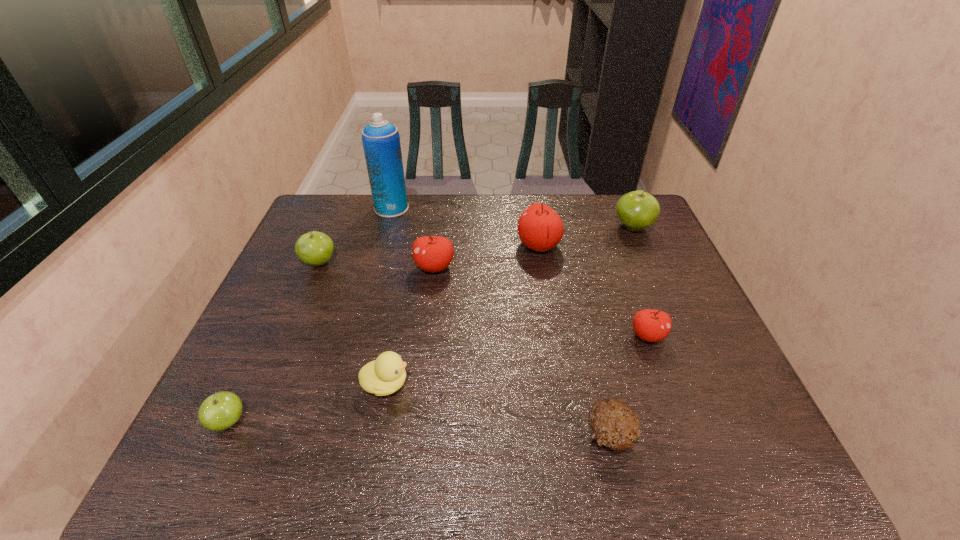
Locate an element on the screen. vacant region located at the beak of the duckling is located at coordinates (564, 384).

This screenshot has height=540, width=960. I want to click on free location located on the left of the sixth farthest object, so click(558, 336).

Identify the location of vacant space located on the right of the nearest green apple. (351, 422).

Locate an element on the screen. The image size is (960, 540). vacant space located 0.370m on the back of the muffin is located at coordinates (576, 292).

Where is `aerosol can that is at the far edge`? Image resolution: width=960 pixels, height=540 pixels. aerosol can that is at the far edge is located at coordinates (381, 142).

Identify the location of apple positioned at the near edge. (220, 411).

Find the location of a particular element. muffin present at the near edge is located at coordinates coord(614,424).

Where is `object positioned at the near left corner`? object positioned at the near left corner is located at coordinates (220, 411).

Where is `object that is at the far right corner`? object that is at the far right corner is located at coordinates point(637,210).

I want to click on vacant point at the far edge, so click(x=597, y=225).